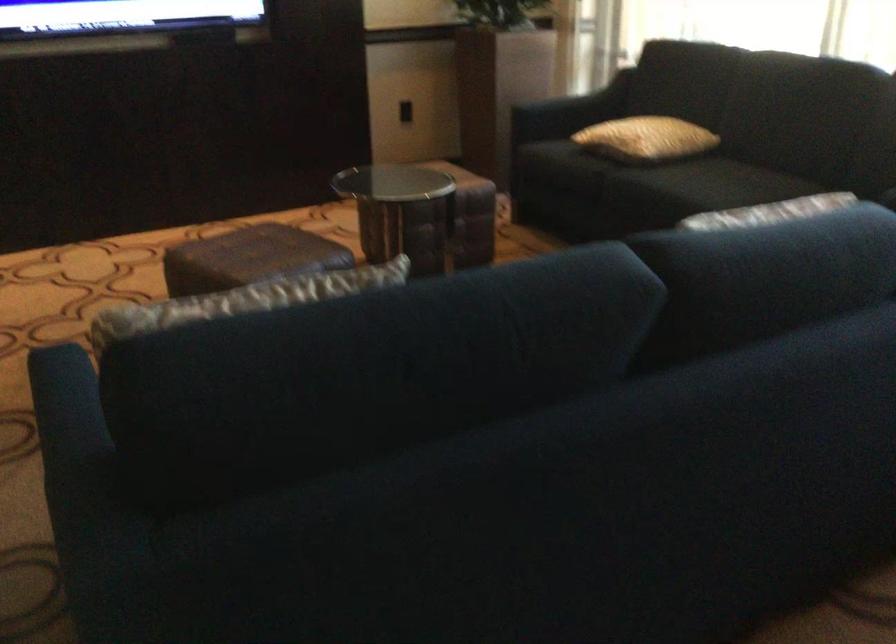
Where would you sit the sofa sitting surface? Please return your answer as a coordinate pair (x, y).

(709, 184)